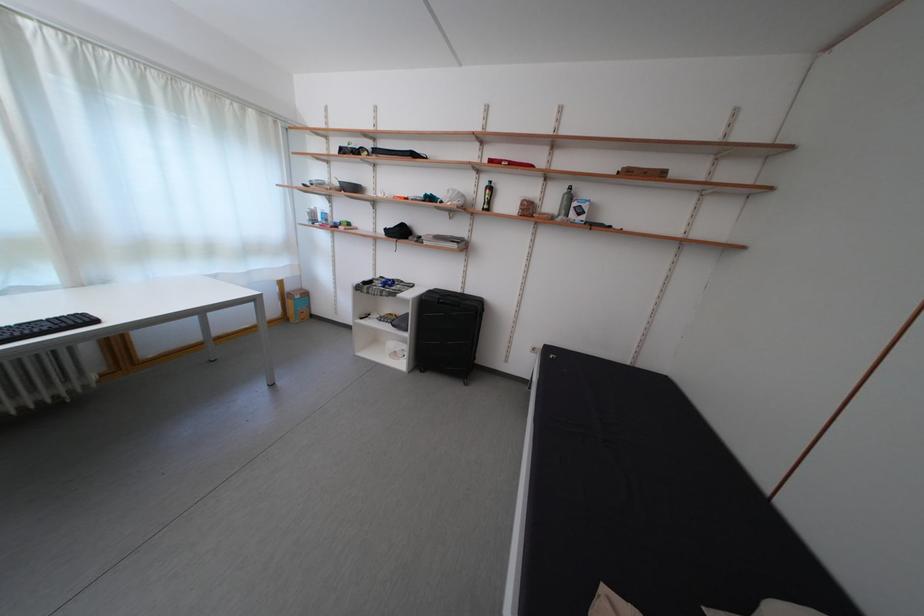
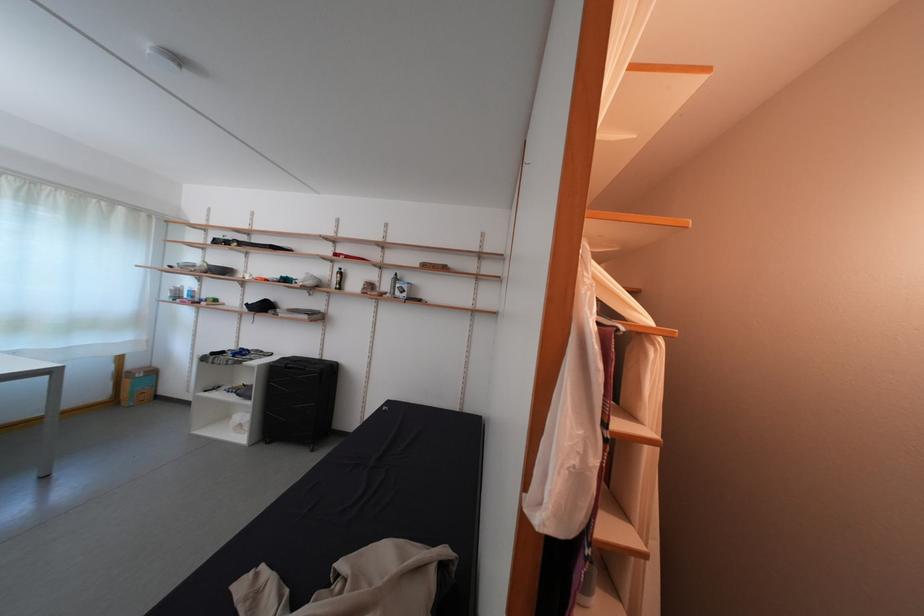
Locate, in the second image, the point that corresponds to pixel 298 294 in the first image.

(140, 371)